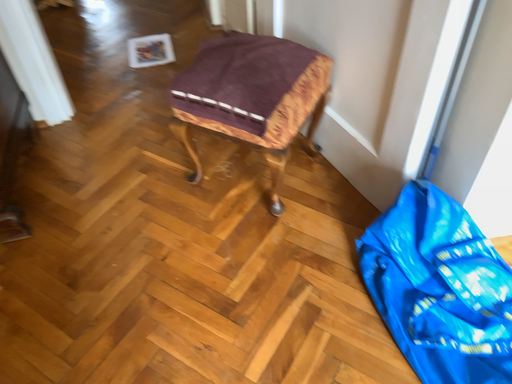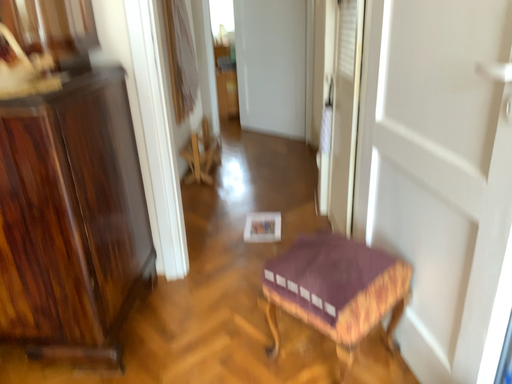
Question: Which way did the camera rotate in the video?

Choices:
 (A) rotated left
 (B) rotated right

Answer: (A)